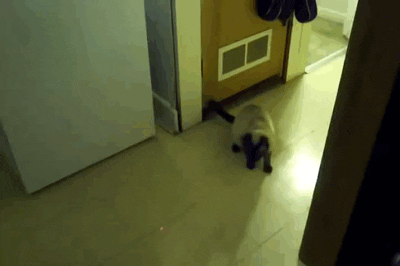
You are a GUI agent. You are given a task and a screenshot of the screen. Output one action in this format:
    pyautogui.click(x=<x>, y=<y>)
    Task: Click on the air vents
    
    Given the screenshot: What is the action you would take?
    pyautogui.click(x=198, y=51), pyautogui.click(x=188, y=52)